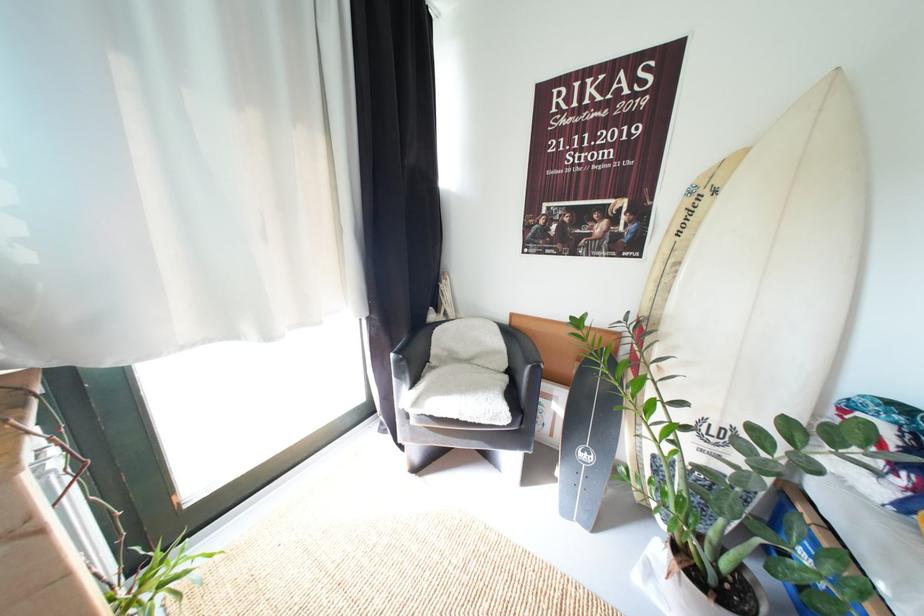
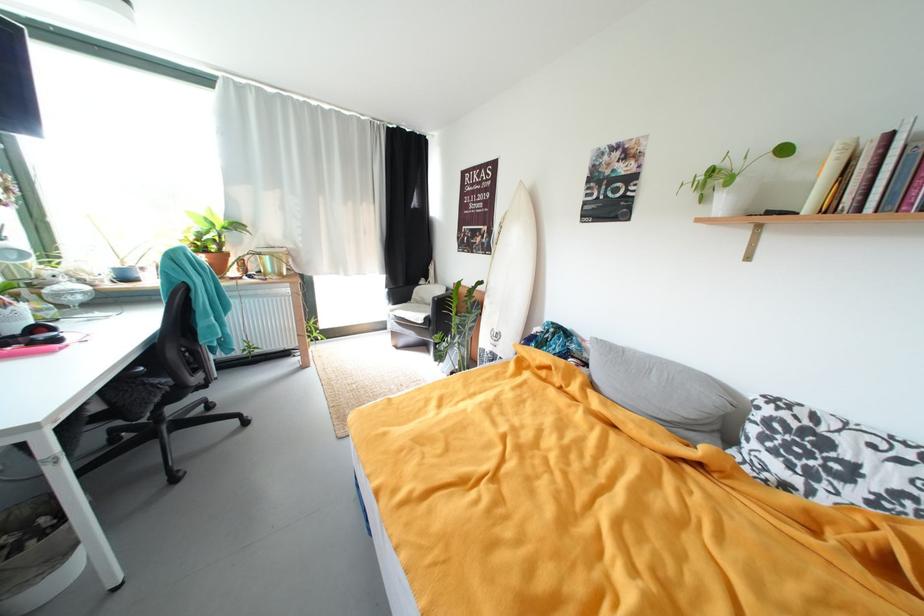
Find the pixel in the second image that matches the point at 649,215 in the first image.

(497, 235)